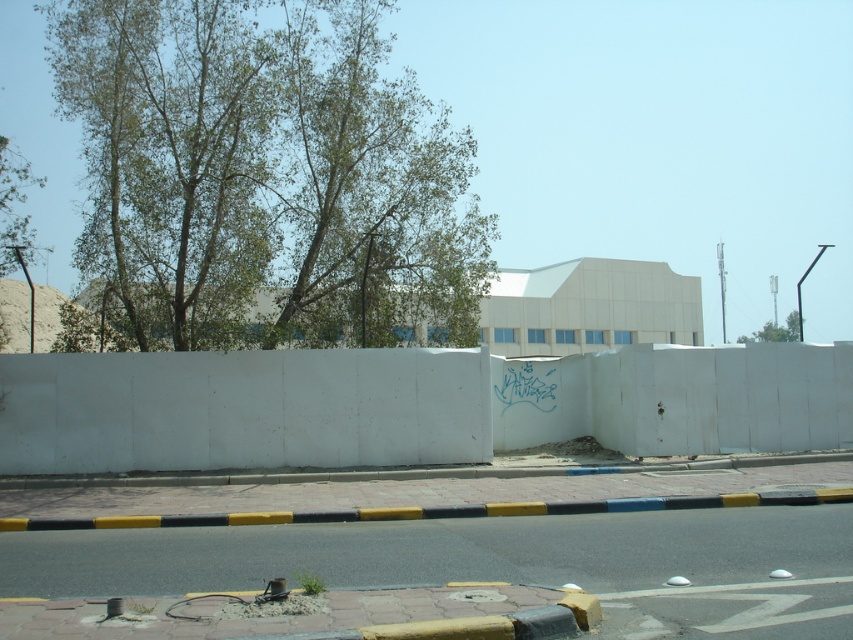
Question: Among these objects, which one is nearest to the camera?

Choices:
 (A) white concrete wall at center
 (B) green leafy tree at upper left
 (C) green leafy tree at upper right

Answer: (A)

Question: Is green leafy tree at upper left wider than green leafy tree at upper right?

Choices:
 (A) no
 (B) yes

Answer: (B)

Question: Does green leafy tree at upper left have a greater width compared to yellow-black striped curb at lower center?

Choices:
 (A) no
 (B) yes

Answer: (B)

Question: Which object is the closest to the yellow-black striped curb at lower center?

Choices:
 (A) white concrete wall at center
 (B) green leafy tree at upper left

Answer: (A)

Question: Is green leafy tree at upper left further to camera compared to white concrete wall at center?

Choices:
 (A) no
 (B) yes

Answer: (B)

Question: Which object is farther from the camera taking this photo?

Choices:
 (A) green leafy tree at upper left
 (B) green leafy tree at upper right
 (C) white concrete wall at center

Answer: (B)